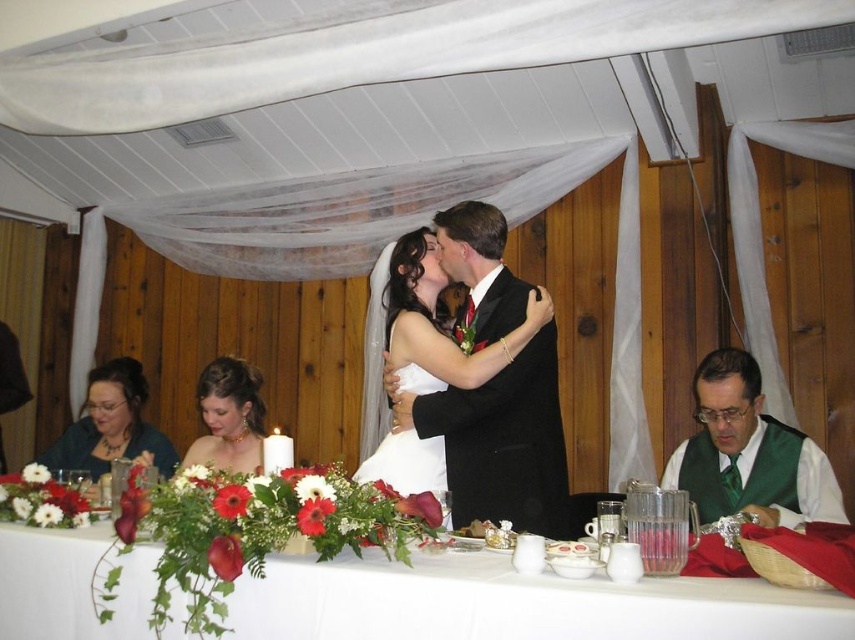
From the picture: Who is higher up, matte white dress at center or matte gold necklace at center?

matte white dress at center is higher up.

Is point (473, 202) in front of point (240, 397)?

Yes, point (473, 202) is in front of point (240, 397).

Locate an element on the screen. The width and height of the screenshot is (855, 640). matte white dress at center is located at coordinates (502, 442).

Is matte white dress at center bigger than green satin vest at lower right?

Yes, matte white dress at center is bigger than green satin vest at lower right.

Does matte white dress at center have a smaller size compared to green satin vest at lower right?

Incorrect, matte white dress at center is not smaller in size than green satin vest at lower right.

The height and width of the screenshot is (640, 855). What are the coordinates of `matte white dress at center` in the screenshot? It's located at (502, 442).

Identify the location of matte white dress at center. This screenshot has height=640, width=855. (502, 442).

Can you confirm if green fabric at left is positioned below matte gold necklace at center?

Indeed, green fabric at left is positioned under matte gold necklace at center.

Can you confirm if green fabric at left is positioned to the right of matte gold necklace at center?

No, green fabric at left is not to the right of matte gold necklace at center.

Does point (74, 428) come in front of point (236, 468)?

No, it is not.

At what (x,y) coordinates should I click in order to perform the action: click on green fabric at left. Please return your answer as a coordinate pair (x, y). The width and height of the screenshot is (855, 640). Looking at the image, I should click on (111, 426).